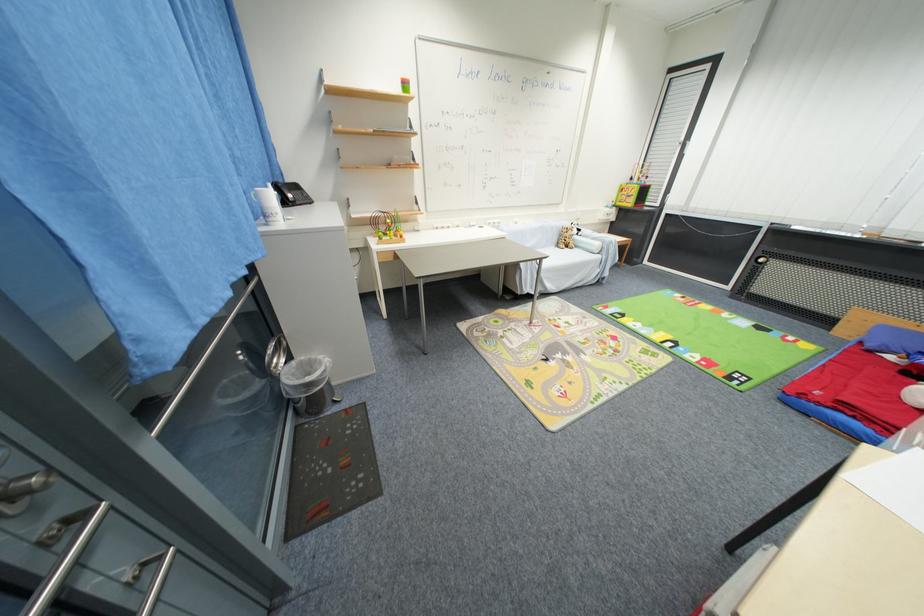
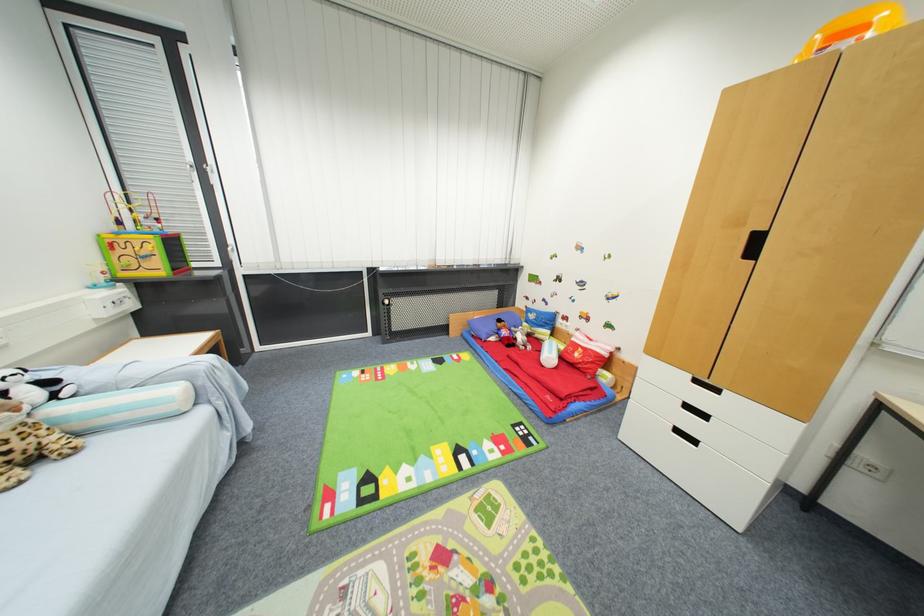
In the second image, find the point that corresponds to [580,238] in the first image.

(64, 411)